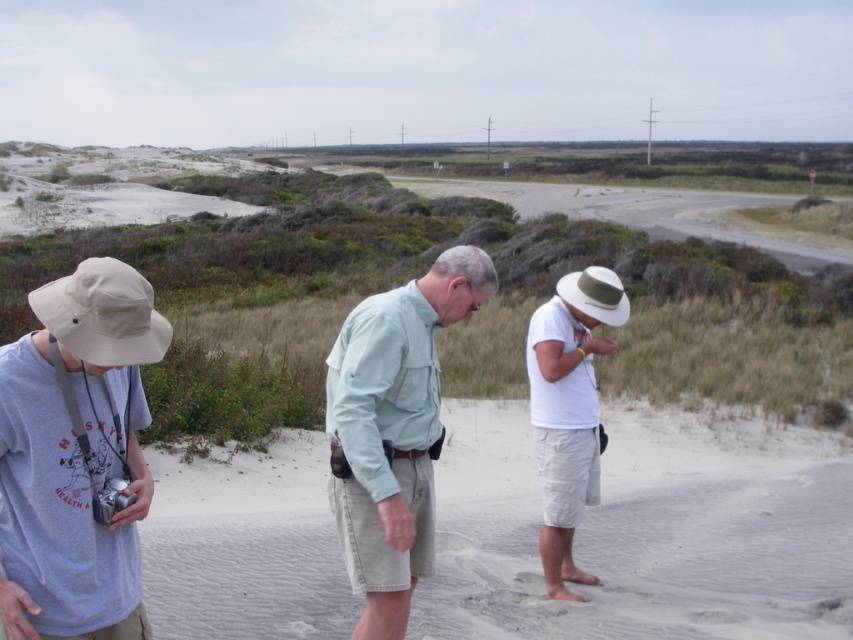
Who is more forward, (x=340, y=413) or (x=26, y=355)?

Point (x=26, y=355) is in front.

Does point (403, 472) come closer to viewer compared to point (45, 616)?

That is False.

Image resolution: width=853 pixels, height=640 pixels. Find the location of `khaki cotton hat at center`. khaki cotton hat at center is located at coordinates (74, 452).

Does point (416, 532) come behind point (404, 420)?

Yes, point (416, 532) is behind point (404, 420).

Which is more to the left, khaki cotton hat at center or light green fabric shirt at center?

light green fabric shirt at center

The image size is (853, 640). What do you see at coordinates (74, 452) in the screenshot?
I see `khaki cotton hat at center` at bounding box center [74, 452].

Where is `khaki cotton hat at center`? khaki cotton hat at center is located at coordinates (x=74, y=452).

Who is higher up, light beige fabric hat at left or white matte hat at center?

light beige fabric hat at left is higher up.

Where is `light beige fabric hat at left`? This screenshot has width=853, height=640. light beige fabric hat at left is located at coordinates (76, 456).

Between point (126, 605) and point (561, 518), which one is positioned behind?

Point (561, 518)

At what (x,y) coordinates should I click in order to perform the action: click on light beige fabric hat at left. Please return your answer as a coordinate pair (x, y). Image resolution: width=853 pixels, height=640 pixels. Looking at the image, I should click on (76, 456).